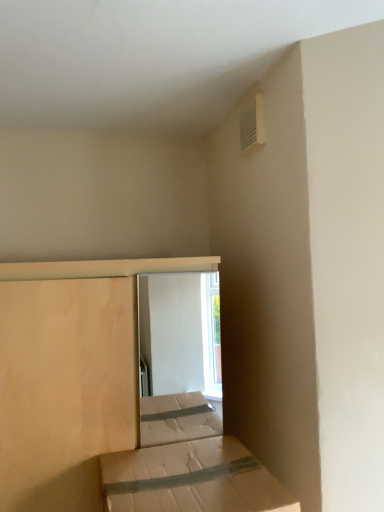
You are a GUI agent. You are given a task and a screenshot of the screen. Output one action in this format:
    pyautogui.click(x=<x>, y=<y>)
    Task: Click on the brown cardboard box at lower center, marked as the second bed in a back-to-front arrangement
    This screenshot has width=384, height=512.
    Given the screenshot: What is the action you would take?
    pyautogui.click(x=189, y=465)

Where is `natural wood bed at center, marked as the 1th bed in a back-to-front arrangement`? The width and height of the screenshot is (384, 512). natural wood bed at center, marked as the 1th bed in a back-to-front arrangement is located at coordinates coord(106,403).

Is natural wood bed at center, marked as the 1th bed in a back-to-front arrangement, directly adjacent to brown cardboard box at lower center, marked as the 1th bed in a front-to-back arrangement?

No, natural wood bed at center, marked as the 1th bed in a back-to-front arrangement, is not beside brown cardboard box at lower center, marked as the 1th bed in a front-to-back arrangement.

Is natural wood bed at center, positioned as the 2th bed in front-to-back order, oriented away from brown cardboard box at lower center, marked as the 1th bed in a front-to-back arrangement?

natural wood bed at center, positioned as the 2th bed in front-to-back order, is not turned away from brown cardboard box at lower center, marked as the 1th bed in a front-to-back arrangement.

From a real-world perspective, is natural wood bed at center, positioned as the 2th bed in front-to-back order, below brown cardboard box at lower center, marked as the 1th bed in a front-to-back arrangement?

No.

Considering the sizes of natural wood bed at center, marked as the 1th bed in a back-to-front arrangement, and brown cardboard box at lower center, marked as the 1th bed in a front-to-back arrangement, in the image, is natural wood bed at center, marked as the 1th bed in a back-to-front arrangement, wider or thinner than brown cardboard box at lower center, marked as the 1th bed in a front-to-back arrangement,?

Considering their sizes, natural wood bed at center, marked as the 1th bed in a back-to-front arrangement, looks broader than brown cardboard box at lower center, marked as the 1th bed in a front-to-back arrangement.

Is natural wood bed at center, positioned as the 2th bed in front-to-back order, aimed at white plastic vent at upper right?

No, natural wood bed at center, positioned as the 2th bed in front-to-back order, does not turn towards white plastic vent at upper right.

Is natural wood bed at center, marked as the 1th bed in a back-to-front arrangement, at the right side of white plastic vent at upper right?

No, natural wood bed at center, marked as the 1th bed in a back-to-front arrangement, is not to the right of white plastic vent at upper right.

From the image's perspective, is natural wood bed at center, positioned as the 2th bed in front-to-back order, above or below white plastic vent at upper right?

From the image's perspective, natural wood bed at center, positioned as the 2th bed in front-to-back order, appears below white plastic vent at upper right.

Is brown cardboard box at lower center, marked as the second bed in a back-to-front arrangement, positioned beyond the bounds of natural wood bed at center, marked as the 1th bed in a back-to-front arrangement?

Absolutely, brown cardboard box at lower center, marked as the second bed in a back-to-front arrangement, is external to natural wood bed at center, marked as the 1th bed in a back-to-front arrangement.

Between point (190, 434) and point (6, 280), which one is positioned behind?

The point (190, 434) is farther from the camera.

In the scene shown: Considering their positions, is brown cardboard box at lower center, marked as the second bed in a back-to-front arrangement, located in front of or behind white plastic vent at upper right?

brown cardboard box at lower center, marked as the second bed in a back-to-front arrangement, is in front of white plastic vent at upper right.

Considering the relative positions of brown cardboard box at lower center, marked as the second bed in a back-to-front arrangement, and white plastic vent at upper right in the image provided, is brown cardboard box at lower center, marked as the second bed in a back-to-front arrangement, to the right of white plastic vent at upper right from the viewer's perspective?

No, brown cardboard box at lower center, marked as the second bed in a back-to-front arrangement, is not to the right of white plastic vent at upper right.

Does brown cardboard box at lower center, marked as the second bed in a back-to-front arrangement, have a greater height compared to white plastic vent at upper right?

Indeed, brown cardboard box at lower center, marked as the second bed in a back-to-front arrangement, has a greater height compared to white plastic vent at upper right.

Can you confirm if brown cardboard box at lower center, marked as the second bed in a back-to-front arrangement, is wider than white plastic vent at upper right?

Yes.

Which of these two, white plastic vent at upper right or natural wood bed at center, positioned as the 2th bed in front-to-back order, is thinner?

white plastic vent at upper right is thinner.

Are white plastic vent at upper right and natural wood bed at center, positioned as the 2th bed in front-to-back order, making contact?

No, white plastic vent at upper right is not in contact with natural wood bed at center, positioned as the 2th bed in front-to-back order.

Would you say white plastic vent at upper right is outside natural wood bed at center, positioned as the 2th bed in front-to-back order?

Absolutely, white plastic vent at upper right is external to natural wood bed at center, positioned as the 2th bed in front-to-back order.

Between white plastic vent at upper right and natural wood bed at center, marked as the 1th bed in a back-to-front arrangement, which one appears on the left side from the viewer's perspective?

From the viewer's perspective, natural wood bed at center, marked as the 1th bed in a back-to-front arrangement, appears more on the left side.

From a real-world perspective, which is physically above, white plastic vent at upper right or brown cardboard box at lower center, marked as the 1th bed in a front-to-back arrangement?

In real-world perspective, white plastic vent at upper right is above.

Could you measure the distance between white plastic vent at upper right and brown cardboard box at lower center, marked as the 1th bed in a front-to-back arrangement?

white plastic vent at upper right is 3.39 feet away from brown cardboard box at lower center, marked as the 1th bed in a front-to-back arrangement.

Would you consider white plastic vent at upper right to be distant from brown cardboard box at lower center, marked as the second bed in a back-to-front arrangement?

white plastic vent at upper right is positioned a significant distance from brown cardboard box at lower center, marked as the second bed in a back-to-front arrangement.

Identify the location of bed located on the left of brown cardboard box at lower center, marked as the second bed in a back-to-front arrangement. (106, 403).

Where is `air conditioning lying behind the natural wood bed at center, positioned as the 2th bed in front-to-back order`? air conditioning lying behind the natural wood bed at center, positioned as the 2th bed in front-to-back order is located at coordinates (252, 124).

Which object lies nearer to the anchor point natural wood bed at center, positioned as the 2th bed in front-to-back order, brown cardboard box at lower center, marked as the 1th bed in a front-to-back arrangement, or white plastic vent at upper right?

Among the two, brown cardboard box at lower center, marked as the 1th bed in a front-to-back arrangement, is located nearer to natural wood bed at center, positioned as the 2th bed in front-to-back order.

When comparing their distances from brown cardboard box at lower center, marked as the second bed in a back-to-front arrangement, does white plastic vent at upper right or natural wood bed at center, positioned as the 2th bed in front-to-back order, seem closer?

natural wood bed at center, positioned as the 2th bed in front-to-back order, lies closer to brown cardboard box at lower center, marked as the second bed in a back-to-front arrangement, than the other object.

From the image, which object appears to be farther from white plastic vent at upper right, brown cardboard box at lower center, marked as the 1th bed in a front-to-back arrangement, or natural wood bed at center, marked as the 1th bed in a back-to-front arrangement?

brown cardboard box at lower center, marked as the 1th bed in a front-to-back arrangement, is further to white plastic vent at upper right.

Looking at the image, which one is located closer to white plastic vent at upper right, natural wood bed at center, marked as the 1th bed in a back-to-front arrangement, or brown cardboard box at lower center, marked as the second bed in a back-to-front arrangement?

natural wood bed at center, marked as the 1th bed in a back-to-front arrangement, is closer to white plastic vent at upper right.

Considering their positions, is white plastic vent at upper right positioned further to natural wood bed at center, positioned as the 2th bed in front-to-back order, than brown cardboard box at lower center, marked as the 1th bed in a front-to-back arrangement?

Among the two, white plastic vent at upper right is located further to natural wood bed at center, positioned as the 2th bed in front-to-back order.

When comparing their distances from brown cardboard box at lower center, marked as the second bed in a back-to-front arrangement, does natural wood bed at center, positioned as the 2th bed in front-to-back order, or white plastic vent at upper right seem further?

Among the two, white plastic vent at upper right is located further to brown cardboard box at lower center, marked as the second bed in a back-to-front arrangement.

Where is `bed between white plastic vent at upper right and brown cardboard box at lower center, marked as the second bed in a back-to-front arrangement, vertically`? bed between white plastic vent at upper right and brown cardboard box at lower center, marked as the second bed in a back-to-front arrangement, vertically is located at coordinates (106, 403).